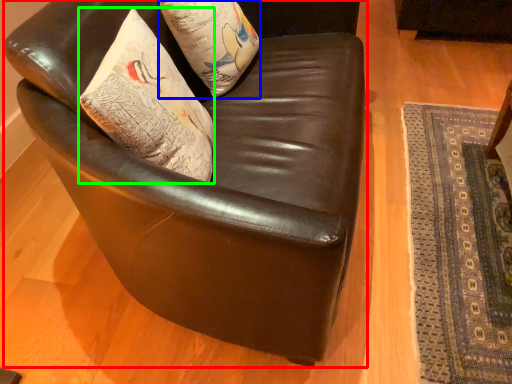
Question: Which object is the farthest from chair (highlighted by a red box)? Choose among these: pillow (highlighted by a blue box) or throw pillow (highlighted by a green box).

Choices:
 (A) pillow
 (B) throw pillow

Answer: (A)